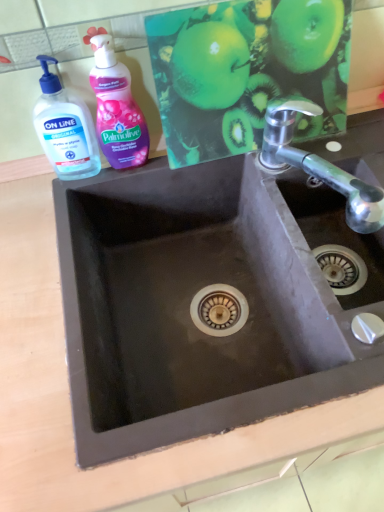
What do you see at coordinates (246, 71) in the screenshot? This screenshot has height=512, width=384. I see `green matte apple at upper center` at bounding box center [246, 71].

This screenshot has width=384, height=512. What do you see at coordinates (65, 128) in the screenshot?
I see `transparent plastic hand soap at upper left` at bounding box center [65, 128].

What do you see at coordinates (195, 294) in the screenshot?
I see `black matte sink at center` at bounding box center [195, 294].

You are a GUI agent. You are given a task and a screenshot of the screen. Output one action in this format:
    pyautogui.click(x=<x>, y=<y>)
    Task: Click on the green matte apple at upper center
    This screenshot has width=384, height=512.
    Given the screenshot: What is the action you would take?
    pyautogui.click(x=246, y=71)

Considering the sizes of transparent plastic hand soap at upper left and polished chrome tap at upper right in the image, is transparent plastic hand soap at upper left bigger or smaller than polished chrome tap at upper right?

Considering their sizes, transparent plastic hand soap at upper left takes up less space than polished chrome tap at upper right.

Is point (63, 152) farther from viewer compared to point (344, 191)?

Yes, it is behind point (344, 191).

Is transparent plastic hand soap at upper left positioned with its back to polished chrome tap at upper right?

transparent plastic hand soap at upper left is not turned away from polished chrome tap at upper right.

Considering the sizes of objects transparent plastic hand soap at upper left and polished chrome tap at upper right in the image provided, who is thinner, transparent plastic hand soap at upper left or polished chrome tap at upper right?

With smaller width is transparent plastic hand soap at upper left.

Is polished chrome tap at upper right taller or shorter than black matte sink at center?

In the image, polished chrome tap at upper right appears to be shorter than black matte sink at center.

From a real-world perspective, is polished chrome tap at upper right positioned over black matte sink at center based on gravity?

Yes, from a real-world perspective, polished chrome tap at upper right is above black matte sink at center.

Which is correct: polished chrome tap at upper right is inside black matte sink at center, or outside of it?

polished chrome tap at upper right lies outside black matte sink at center.

Is polished chrome tap at upper right facing away from black matte sink at center?

polished chrome tap at upper right is not turned away from black matte sink at center.

Does black matte sink at center have a greater height compared to transparent plastic hand soap at upper left?

Correct, black matte sink at center is much taller as transparent plastic hand soap at upper left.

Which of these two, black matte sink at center or transparent plastic hand soap at upper left, is wider?

black matte sink at center.

Is black matte sink at center positioned beyond the bounds of transparent plastic hand soap at upper left?

That's correct, black matte sink at center is outside of transparent plastic hand soap at upper left.

From the image's perspective, would you say black matte sink at center is positioned over transparent plastic hand soap at upper left?

No, from the image's perspective, black matte sink at center is not over transparent plastic hand soap at upper left.

Is green matte apple at upper center located within transparent plastic hand soap at upper left?

No, transparent plastic hand soap at upper left does not contain green matte apple at upper center.

Measure the distance from transparent plastic hand soap at upper left to green matte apple at upper center.

transparent plastic hand soap at upper left is 10.57 inches from green matte apple at upper center.

From the image's perspective, is transparent plastic hand soap at upper left on green matte apple at upper center?

No, from the image's perspective, transparent plastic hand soap at upper left is not above green matte apple at upper center.

Does transparent plastic hand soap at upper left have a greater width compared to green matte apple at upper center?

Indeed, transparent plastic hand soap at upper left has a greater width compared to green matte apple at upper center.

Would you say black matte sink at center is inside or outside polished chrome tap at upper right?

black matte sink at center exists outside the volume of polished chrome tap at upper right.

Which object is further away from the camera taking this photo, black matte sink at center or polished chrome tap at upper right?

polished chrome tap at upper right is further away from the camera.

Is polished chrome tap at upper right at the back of black matte sink at center?

No, black matte sink at center is not facing the opposite direction of polished chrome tap at upper right.

From a real-world perspective, is black matte sink at center below polished chrome tap at upper right?

Yes, from a real-world perspective, black matte sink at center is under polished chrome tap at upper right.

Is transparent plastic hand soap at upper left surrounded by pink glossy liquid soap at upper left?

No.

Does point (116, 117) appear closer or farther from the camera than point (53, 85)?

Clearly, point (116, 117) is more distant from the camera than point (53, 85).

From a real-world perspective, between pink glossy liquid soap at upper left and transparent plastic hand soap at upper left, who is vertically lower?

transparent plastic hand soap at upper left.

Locate an element on the screen. This screenshot has height=512, width=384. bottle below the pink glossy liquid soap at upper left (from a real-world perspective) is located at coordinates (65, 128).

Find the location of a particular element. This screenshot has height=512, width=384. apple behind the polished chrome tap at upper right is located at coordinates (246, 71).

Is point (292, 123) behind point (338, 15)?

Yes, it is.

Consider the image. Is polished chrome tap at upper right not inside green matte apple at upper center?

polished chrome tap at upper right is positioned outside green matte apple at upper center.

Find the location of a particular element. tap in front of the transparent plastic hand soap at upper left is located at coordinates (318, 164).

Where is `tap above the black matte sink at center (from the image's perspective)`? tap above the black matte sink at center (from the image's perspective) is located at coordinates (318, 164).

Based on their spatial positions, is transparent plastic hand soap at upper left or green matte apple at upper center further from pink glossy liquid soap at upper left?

The object further to pink glossy liquid soap at upper left is green matte apple at upper center.

Considering their positions, is black matte sink at center positioned closer to transparent plastic hand soap at upper left than pink glossy liquid soap at upper left?

pink glossy liquid soap at upper left is positioned closer to the anchor transparent plastic hand soap at upper left.

Based on their spatial positions, is transparent plastic hand soap at upper left or pink glossy liquid soap at upper left closer to polished chrome tap at upper right?

pink glossy liquid soap at upper left is positioned closer to the anchor polished chrome tap at upper right.

Considering their positions, is pink glossy liquid soap at upper left positioned further to black matte sink at center than transparent plastic hand soap at upper left?

transparent plastic hand soap at upper left is further to black matte sink at center.

Looking at the image, which one is located closer to polished chrome tap at upper right, black matte sink at center or green matte apple at upper center?

green matte apple at upper center is positioned closer to the anchor polished chrome tap at upper right.

Looking at the image, which one is located further to polished chrome tap at upper right, pink glossy liquid soap at upper left or black matte sink at center?

Based on the image, pink glossy liquid soap at upper left appears to be further to polished chrome tap at upper right.

Looking at this image, estimate the real-world distances between objects in this image. Which object is further from green matte apple at upper center, polished chrome tap at upper right or pink glossy liquid soap at upper left?

Based on the image, pink glossy liquid soap at upper left appears to be further to green matte apple at upper center.

Estimate the real-world distances between objects in this image. Which object is closer to pink glossy liquid soap at upper left, green matte apple at upper center or polished chrome tap at upper right?

Among the two, green matte apple at upper center is located nearer to pink glossy liquid soap at upper left.

Identify the location of cleaning product situated between transparent plastic hand soap at upper left and black matte sink at center from left to right. (116, 106).

Image resolution: width=384 pixels, height=512 pixels. What are the coordinates of `cleaning product located between transparent plastic hand soap at upper left and green matte apple at upper center in the left-right direction` in the screenshot? It's located at (116, 106).

The image size is (384, 512). In order to click on apple located between transparent plastic hand soap at upper left and polished chrome tap at upper right in the left-right direction in this screenshot , I will do `click(246, 71)`.

The height and width of the screenshot is (512, 384). Find the location of `cleaning product between green matte apple at upper center and black matte sink at center from top to bottom`. cleaning product between green matte apple at upper center and black matte sink at center from top to bottom is located at coordinates (116, 106).